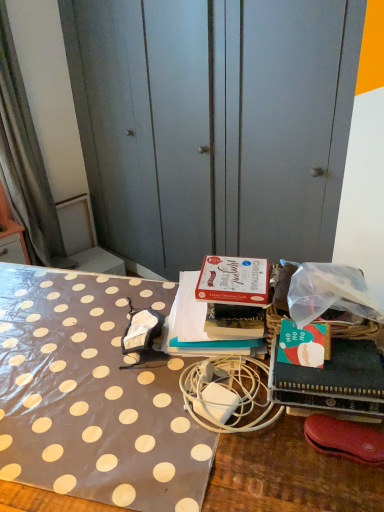
Identify the location of free space in front of leather-like red shoe at lower right. (345, 486).